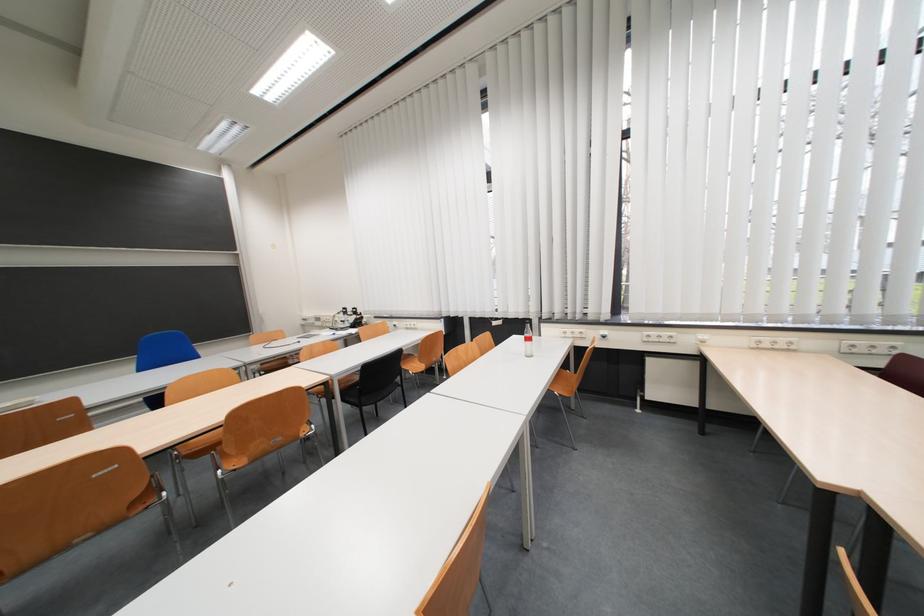
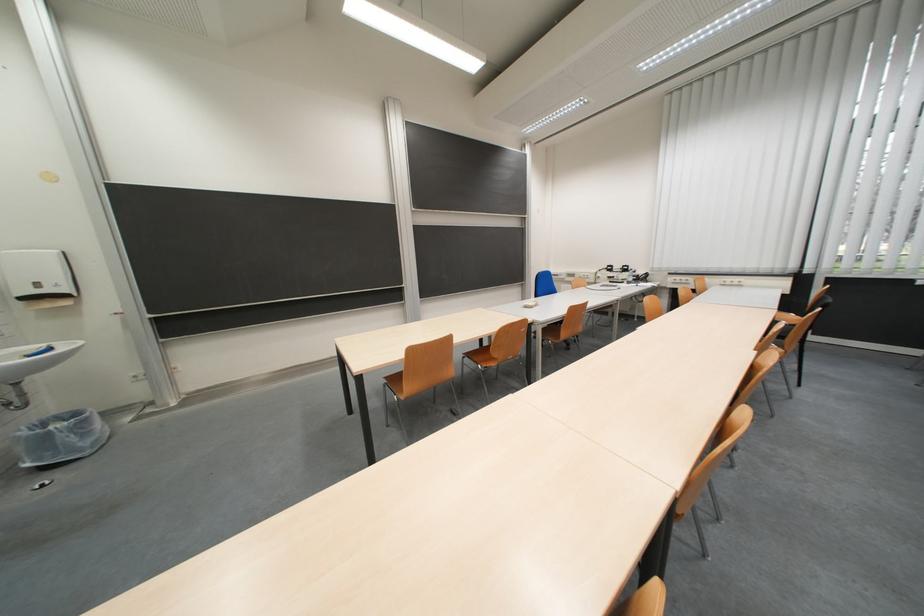
What movement of the cameraman would produce the second image?

The movement direction of the cameraman is left, backward.